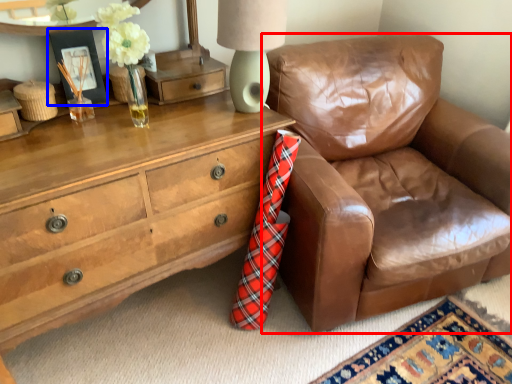
Question: Which object appears closest to the camera in this image, chair (highlighted by a red box) or picture frame (highlighted by a blue box)?

Choices:
 (A) chair
 (B) picture frame

Answer: (A)